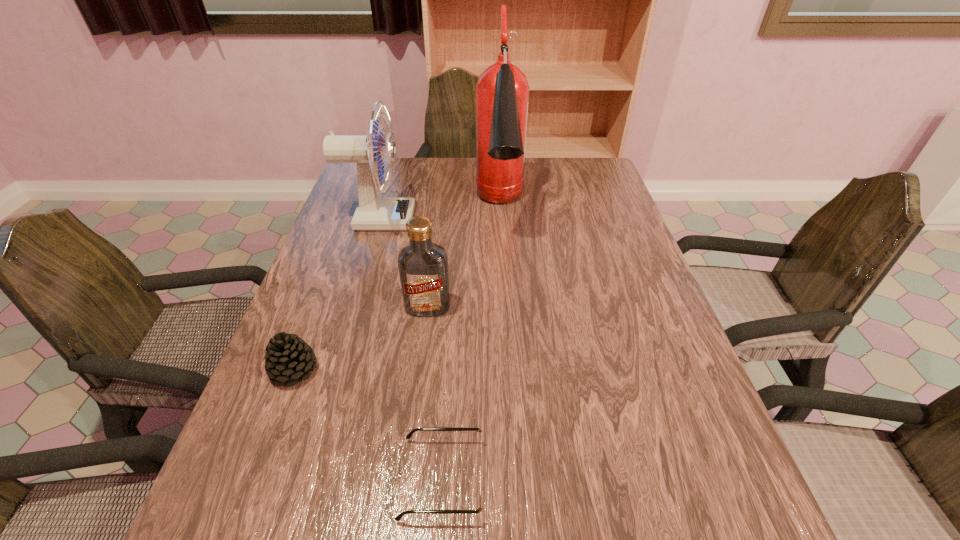
In the image, there is a desktop. At what (x,y) coordinates should I click in order to perform the action: click on vacant region at the near right corner. Please return your answer as a coordinate pair (x, y). The width and height of the screenshot is (960, 540). Looking at the image, I should click on 658,535.

Image resolution: width=960 pixels, height=540 pixels. Identify the location of free space between the pinecone and the third nearest object. (361, 339).

What are the coordinates of `free space that is in between the fourth farthest object and the third tallest object` in the screenshot? It's located at (361, 339).

Where is `unoccupied position between the second shortest object and the vodka`? The width and height of the screenshot is (960, 540). unoccupied position between the second shortest object and the vodka is located at coordinates (361, 339).

Find the location of `free space between the second nearest object and the shortest object`. free space between the second nearest object and the shortest object is located at coordinates click(x=369, y=424).

Locate an element on the screen. This screenshot has width=960, height=540. vacant point located between the fire extinguisher and the shortest object is located at coordinates (471, 344).

The image size is (960, 540). Identify the location of vacant region between the fan and the fire extinguisher. (440, 214).

Identify the location of vacant area between the vodka and the shortest object. This screenshot has width=960, height=540. (436, 393).

Image resolution: width=960 pixels, height=540 pixels. I want to click on free point between the fire extinguisher and the fourth shortest object, so click(x=440, y=214).

In order to click on empty location between the fourth farthest object and the nearest object in this screenshot , I will do `click(369, 424)`.